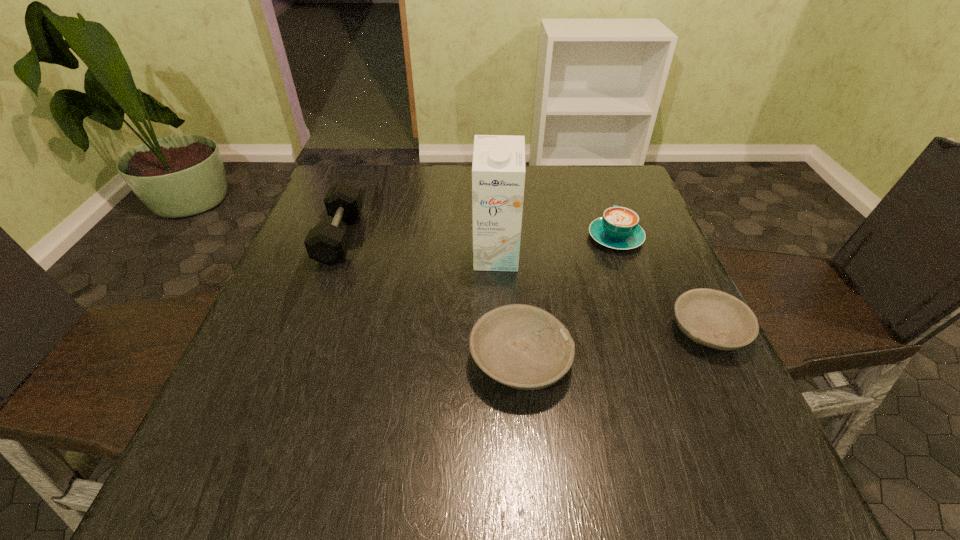
You are a GUI agent. You are given a task and a screenshot of the screen. Output one action in this format:
    pyautogui.click(x=<x>, y=<y>)
    Task: Click on the left bowl
    This screenshot has height=540, width=960.
    Given the screenshot: What is the action you would take?
    pyautogui.click(x=521, y=346)

Where is `the shorter bowl`? The height and width of the screenshot is (540, 960). the shorter bowl is located at coordinates (713, 318).

Find the location of a particular element. This screenshot has width=960, height=540. the right bowl is located at coordinates (713, 318).

This screenshot has width=960, height=540. I want to click on the tallest object, so click(x=498, y=169).

Image resolution: width=960 pixels, height=540 pixels. In order to click on the leftmost object in this screenshot , I will do `click(327, 243)`.

Find the location of a particular element. The width and height of the screenshot is (960, 540). dumbbell is located at coordinates (327, 243).

This screenshot has width=960, height=540. I want to click on cappuccino, so click(x=618, y=229).

Locate an element on the screen. The height and width of the screenshot is (540, 960). free location located on the back of the left bowl is located at coordinates (512, 258).

This screenshot has height=540, width=960. Find the location of `vacant space located 0.140m on the left of the shorter bowl`. vacant space located 0.140m on the left of the shorter bowl is located at coordinates (599, 330).

At what (x,y) coordinates should I click in order to perform the action: click on vacant space situated on the front of the tallest object. Please return your answer as a coordinate pair (x, y). The height and width of the screenshot is (540, 960). Looking at the image, I should click on (498, 319).